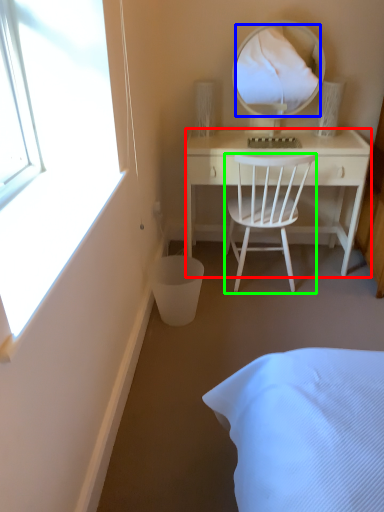
Question: Which object is the closest to the desk (highlighted by a red box)? Choose among these: mirror (highlighted by a blue box) or chair (highlighted by a green box).

Choices:
 (A) mirror
 (B) chair

Answer: (B)